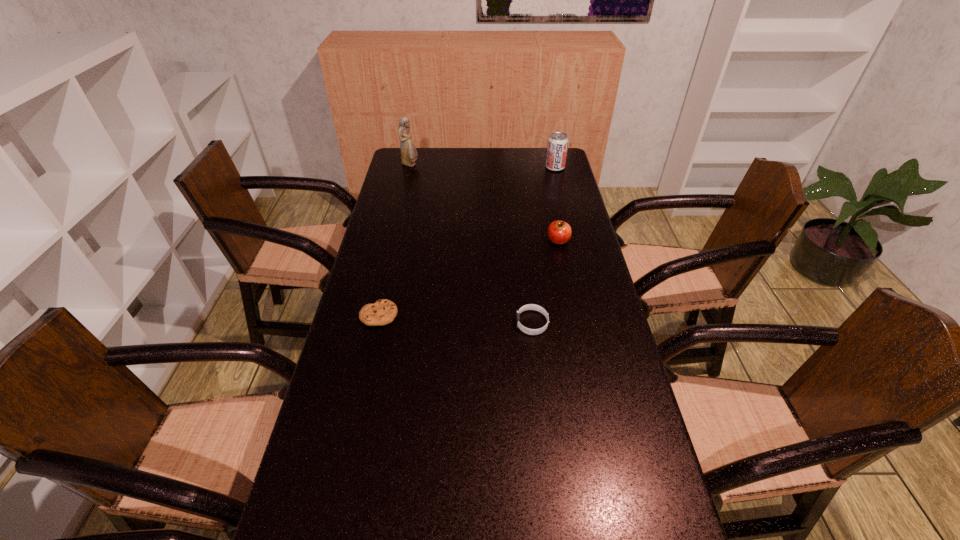
At what (x,y) coordinates should I click in order to perform the action: click on the tallest object. Please return your answer as a coordinate pair (x, y). This screenshot has width=960, height=540. Looking at the image, I should click on (409, 154).

Where is `the second tallest object`? The width and height of the screenshot is (960, 540). the second tallest object is located at coordinates (557, 147).

At what (x,y) coordinates should I click in order to perform the action: click on the third farthest object. Please return your answer as a coordinate pair (x, y). The image size is (960, 540). Looking at the image, I should click on (559, 232).

Locate an element on the screen. The width and height of the screenshot is (960, 540). apple is located at coordinates (559, 232).

Where is `wristband`? Image resolution: width=960 pixels, height=540 pixels. wristband is located at coordinates (538, 308).

The image size is (960, 540). I want to click on the second shortest object, so click(538, 308).

Where is `cookie`? cookie is located at coordinates (382, 312).

The height and width of the screenshot is (540, 960). What are the coordinates of `free space located on the front-facing side of the figurine` in the screenshot? It's located at (501, 165).

At what (x,y) coordinates should I click in order to perform the action: click on free space located 0.230m on the front of the fourth shortest object. Please return your answer as a coordinate pair (x, y). The height and width of the screenshot is (540, 960). Looking at the image, I should click on [x=564, y=203].

Find the location of a particular element. free space located 0.290m on the back of the third nearest object is located at coordinates (547, 189).